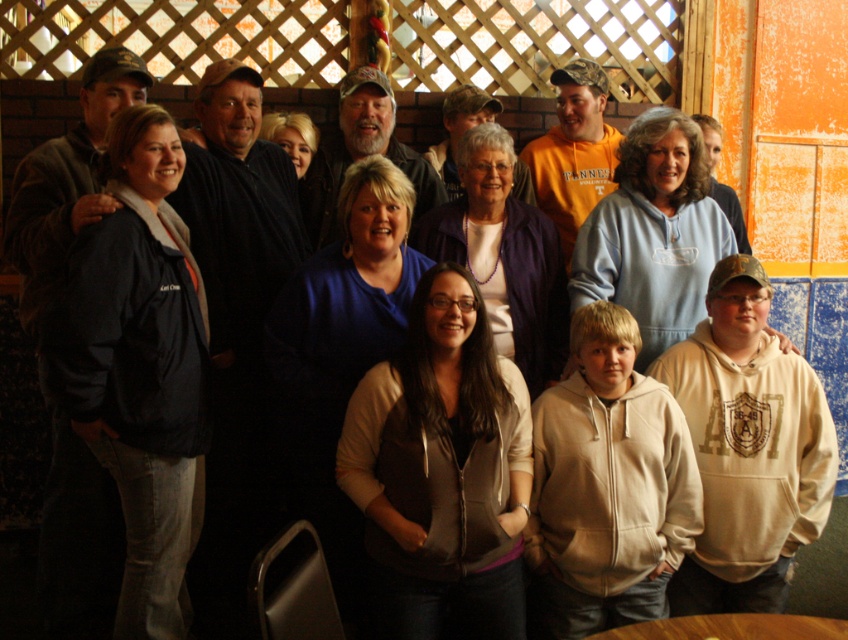
Question: Is dark blue jacket at left wider than matte brown vest at center?

Choices:
 (A) yes
 (B) no

Answer: (B)

Question: Which is farther from the dark blue jacket at left?

Choices:
 (A) light blue fleece at center
 (B) matte brown vest at center
 (C) purple fabric at center

Answer: (A)

Question: Observing the image, what is the correct spatial positioning of dark blue jacket at left in reference to purple fabric at center?

Choices:
 (A) below
 (B) above

Answer: (A)

Question: Does dark blue jacket at left have a lesser width compared to purple fabric at center?

Choices:
 (A) no
 (B) yes

Answer: (A)

Question: Which point is closer to the camera?

Choices:
 (A) (633, 184)
 (B) (473, 579)
 (C) (511, 164)
 (D) (132, 157)

Answer: (B)

Question: Which point is closer to the camera?

Choices:
 (A) matte brown vest at center
 (B) purple fabric at center
 (C) dark blue jacket at left
 (D) light blue fleece at center

Answer: (A)